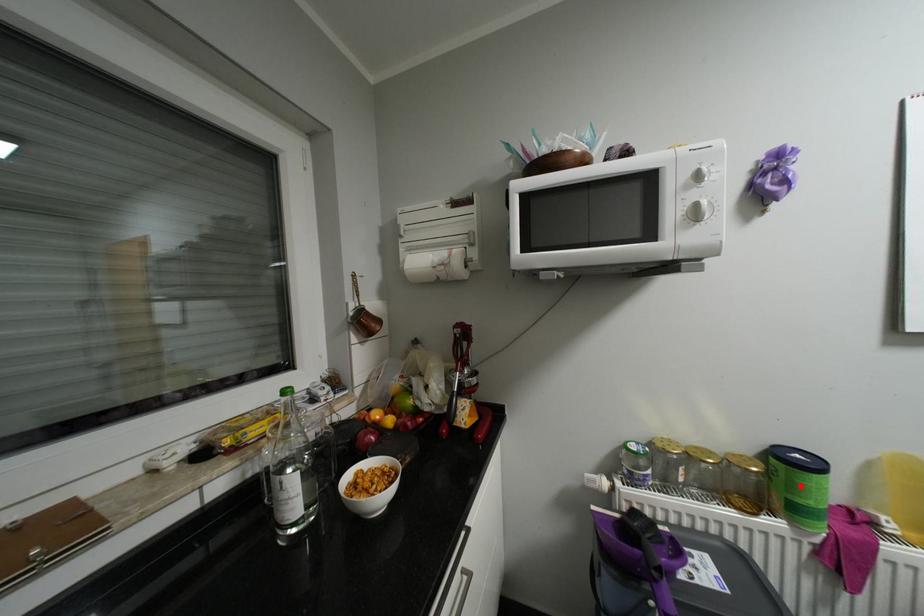
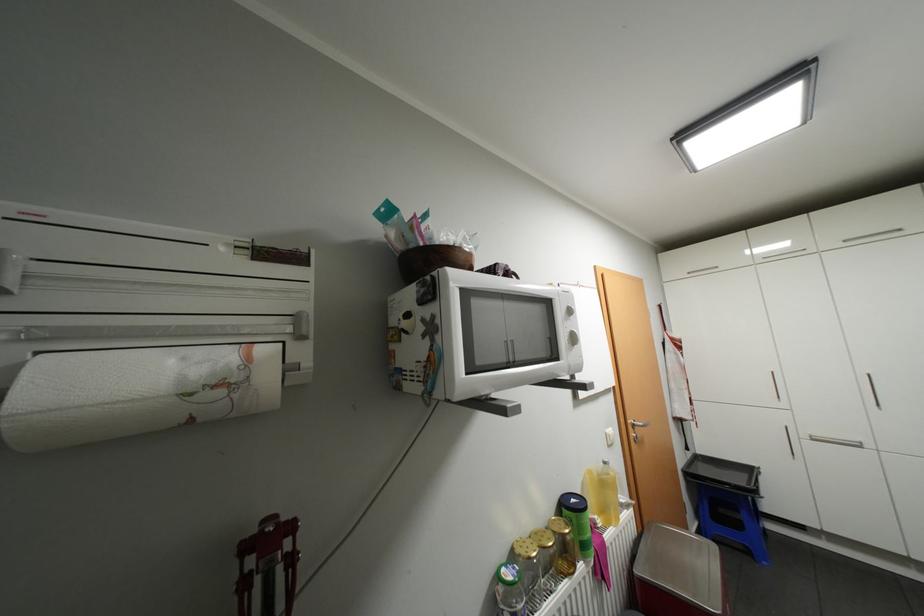
Find the pixel in the second image that matches the highlighted location in the first image.

(589, 528)